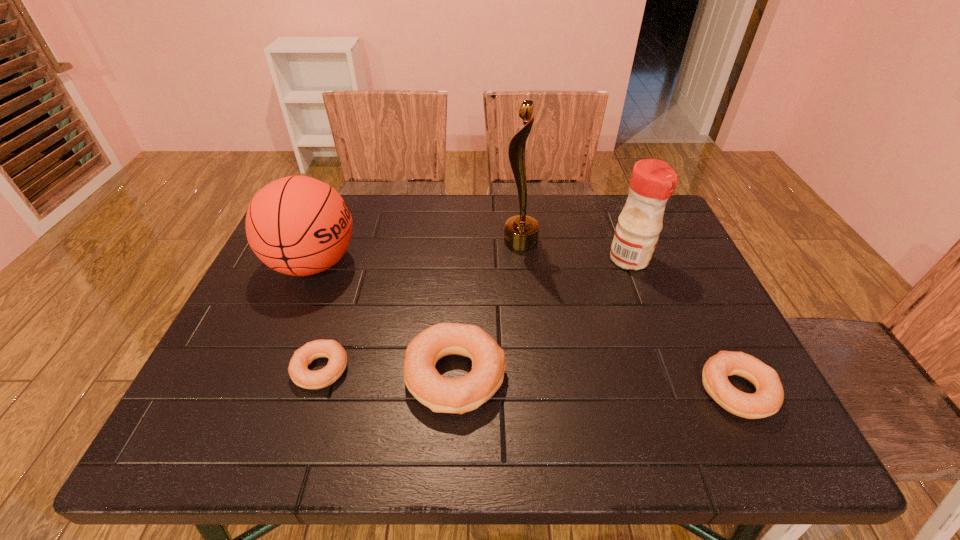
Select which object appears as the third closest to the third object from left to right. Please provide its 2D coordinates. Your answer should be formatted as a tuple, i.e. [(x, y)], where the tuple contains the x and y coordinates of a point satisfying the conditions above.

[(521, 232)]

Locate which object is the second closest to the condiment. Please provide its 2D coordinates. Your answer should be formatted as a tuple, i.e. [(x, y)], where the tuple contains the x and y coordinates of a point satisfying the conditions above.

[(768, 398)]

Locate which bagel is the second closest to the third object from left to right. Please provide its 2D coordinates. Your answer should be formatted as a tuple, i.e. [(x, y)], where the tuple contains the x and y coordinates of a point satisfying the conditions above.

[(768, 398)]

Identify which bagel is located as the second nearest to the tallest bagel. Please provide its 2D coordinates. Your answer should be formatted as a tuple, i.e. [(x, y)], where the tuple contains the x and y coordinates of a point satisfying the conditions above.

[(768, 398)]

The image size is (960, 540). I want to click on free location that satisfies the following two spatial constraints: 1. on the front-facing side of the award; 2. on the left side of the second shortest object, so click(x=537, y=390).

Identify the location of vacant space that satisfies the following two spatial constraints: 1. on the side with logo of the second shortest object; 2. on the left side of the basketball. (260, 390).

Where is `free point that satisfies the following two spatial constraints: 1. on the front-facing side of the condiment; 2. on the right side of the tallest object`? free point that satisfies the following two spatial constraints: 1. on the front-facing side of the condiment; 2. on the right side of the tallest object is located at coordinates (522, 259).

Identify the location of vacant position in the image that satisfies the following two spatial constraints: 1. on the side with logo of the basketball; 2. on the back side of the second shortest object. The height and width of the screenshot is (540, 960). (260, 390).

Identify the location of blank area in the image that satisfies the following two spatial constraints: 1. on the back side of the condiment; 2. on the front-facing side of the tallest object. The width and height of the screenshot is (960, 540). (623, 241).

Where is `free space that satisfies the following two spatial constraints: 1. on the side with logo of the basketball; 2. on the right side of the rightmost bagel`? free space that satisfies the following two spatial constraints: 1. on the side with logo of the basketball; 2. on the right side of the rightmost bagel is located at coordinates (260, 390).